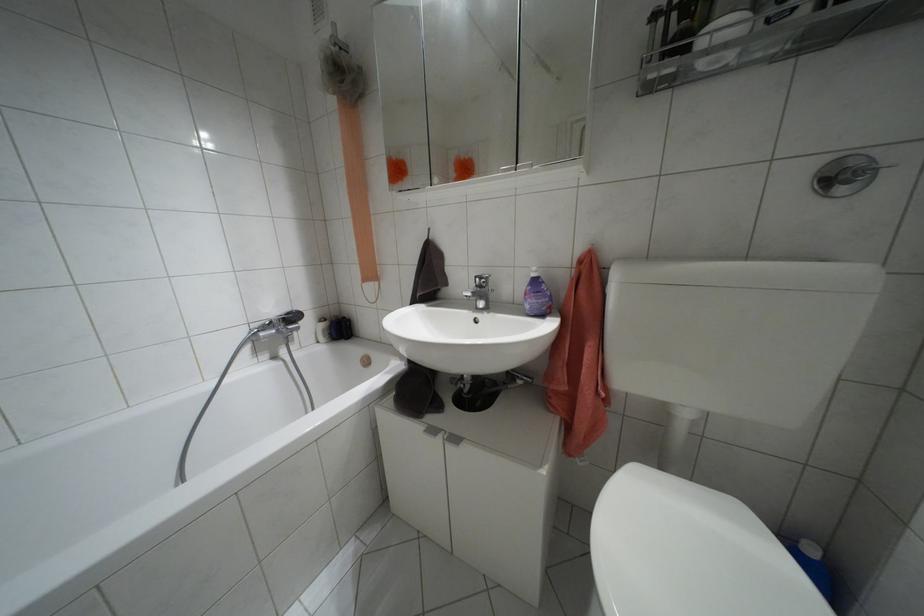
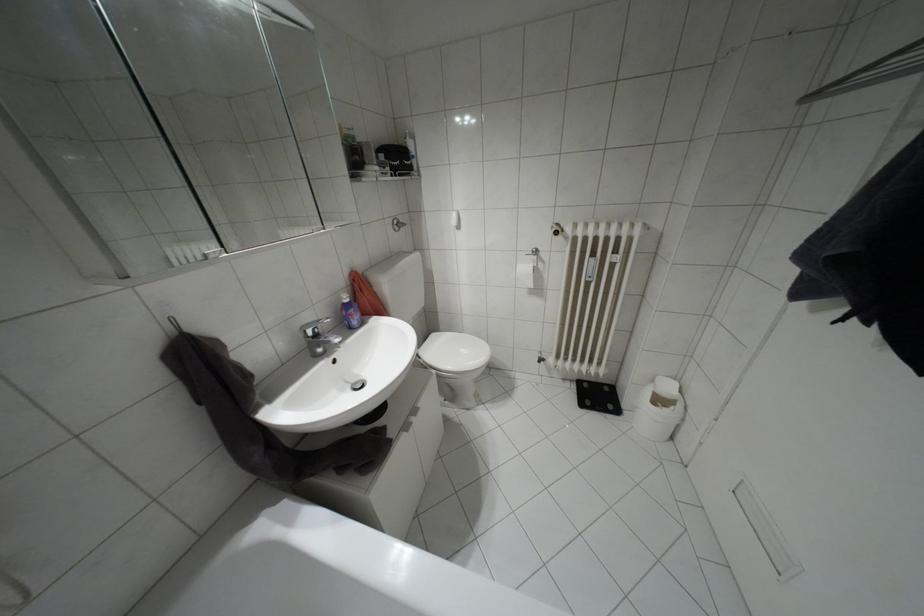
Where in the second image is the point corresponding to point (841, 190) from the first image?

(395, 229)